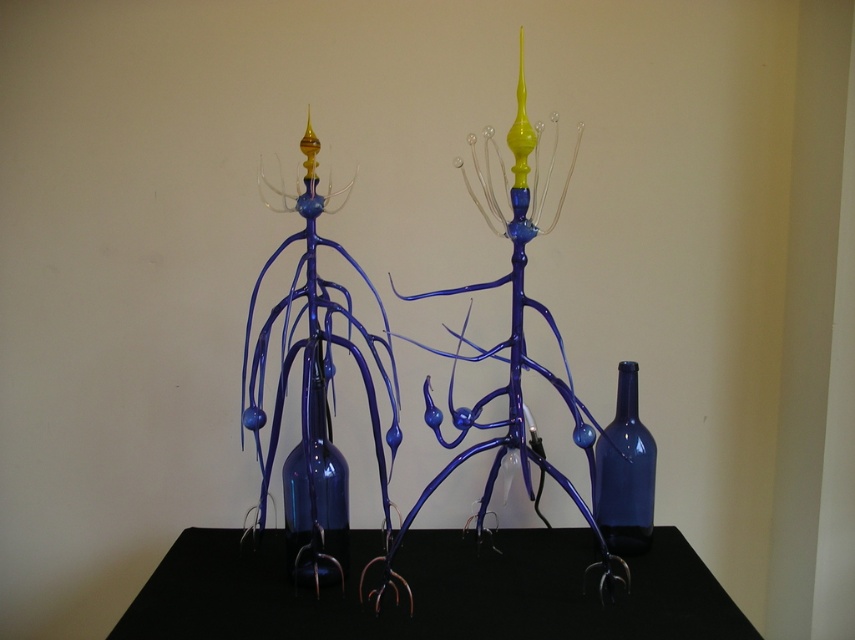
You are standing in front of the sculptures and want to touch the point at coordinate (520,588). Is this point within your reach if your arm can extend 1.2 meters?

The point at coordinate (520,588) is 1.26 meters away from the camera, which is slightly beyond your arm reach of 1.2 meters. You cannot touch it.

You are an art curator planning to install a new sculpture in the gallery. The new sculpture requires a base that is 1.2 meters wide. The black matte table at center is currently positioned at coordinates point 0.925, 0.508. Can the table accommodate the new sculpture if the required base width is 1.2 meters?

The position of the black matte table at center is at point (433, 592), but there is no information provided about the table dimensions. Therefore, it is impossible to determine if the table can accommodate the new sculpture requiring a 1.2 meter wide base without knowing the table size.